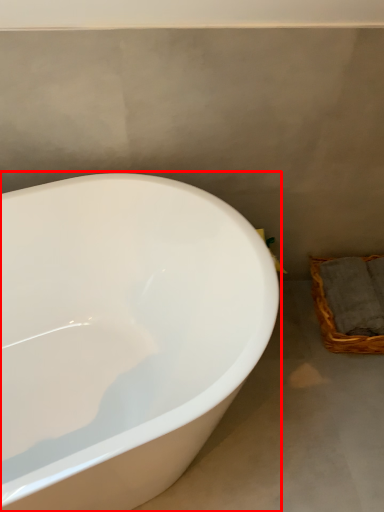
Question: Where is bathtub (annotated by the red box) located in relation to basket in the image?

Choices:
 (A) right
 (B) left

Answer: (B)